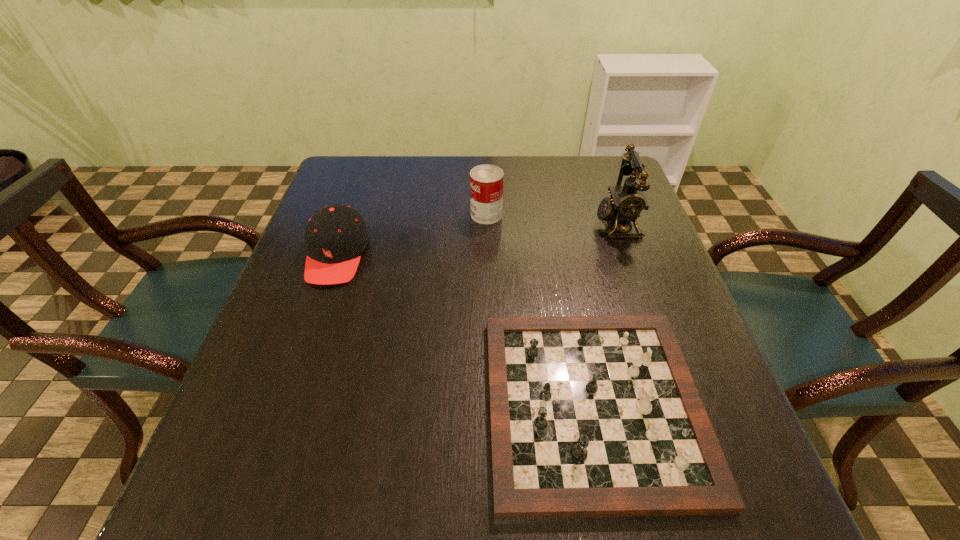
Where is `free spot that satisfies the following two spatial constraints: 1. on the rotary dial of the telephone; 2. on the front-facing side of the cap`? free spot that satisfies the following two spatial constraints: 1. on the rotary dial of the telephone; 2. on the front-facing side of the cap is located at coordinates (628, 255).

Where is `free space that satisfies the following two spatial constraints: 1. on the rotary dial of the tallest object; 2. on the front side of the chessboard`? Image resolution: width=960 pixels, height=540 pixels. free space that satisfies the following two spatial constraints: 1. on the rotary dial of the tallest object; 2. on the front side of the chessboard is located at coordinates (681, 405).

Where is `free region that satisfies the following two spatial constraints: 1. on the back side of the nearest object; 2. on the front label of the can`? free region that satisfies the following two spatial constraints: 1. on the back side of the nearest object; 2. on the front label of the can is located at coordinates (555, 214).

I want to click on free region that satisfies the following two spatial constraints: 1. on the rotary dial of the telephone; 2. on the front-facing side of the cap, so click(628, 255).

What are the coordinates of `vacant space that satisfies the following two spatial constraints: 1. on the front label of the can; 2. on the front-facing side of the second shortest object` in the screenshot? It's located at (487, 255).

Locate an element on the screen. The height and width of the screenshot is (540, 960). vacant space that satisfies the following two spatial constraints: 1. on the front-facing side of the cap; 2. on the left side of the nearest object is located at coordinates pos(285,405).